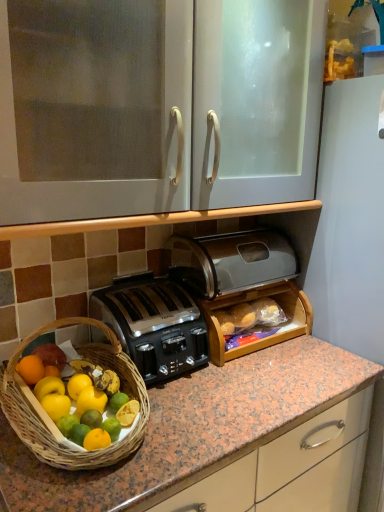
Question: Can you confirm if wooden bread box at center, which is the second cabinetry in top-to-bottom order, is bigger than satin black toaster at center, arranged as the second toaster when ordered from the bottom?

Choices:
 (A) no
 (B) yes

Answer: (A)

Question: Does wooden bread box at center, acting as the first cabinetry starting from the bottom, have a smaller size compared to satin black toaster at center, arranged as the first toaster when viewed from the top?

Choices:
 (A) no
 (B) yes

Answer: (B)

Question: Can you confirm if wooden bread box at center, which is the second cabinetry in top-to-bottom order, is wider than satin black toaster at center, arranged as the first toaster when viewed from the top?

Choices:
 (A) no
 (B) yes

Answer: (A)

Question: Is wooden bread box at center, acting as the first cabinetry starting from the bottom, thinner than satin black toaster at center, arranged as the first toaster when viewed from the top?

Choices:
 (A) no
 (B) yes

Answer: (B)

Question: Does wooden bread box at center, acting as the first cabinetry starting from the bottom, contain satin black toaster at center, arranged as the second toaster when ordered from the bottom?

Choices:
 (A) yes
 (B) no

Answer: (B)

Question: Is wooden bread box at center, which is the second cabinetry in top-to-bottom order, to the right of satin black toaster at center, arranged as the first toaster when viewed from the top, from the viewer's perspective?

Choices:
 (A) yes
 (B) no

Answer: (A)

Question: Is the depth of wooden bread box at center, which is the second cabinetry in top-to-bottom order, greater than that of white glossy cabinet at upper center, which ranks as the 1th cabinetry in top-to-bottom order?

Choices:
 (A) no
 (B) yes

Answer: (B)

Question: Can you confirm if wooden bread box at center, acting as the first cabinetry starting from the bottom, is wider than white glossy cabinet at upper center, the second cabinetry ordered from the bottom?

Choices:
 (A) yes
 (B) no

Answer: (B)

Question: Is wooden bread box at center, acting as the first cabinetry starting from the bottom, far away from white glossy cabinet at upper center, which ranks as the 1th cabinetry in top-to-bottom order?

Choices:
 (A) no
 (B) yes

Answer: (A)

Question: Does wooden bread box at center, acting as the first cabinetry starting from the bottom, have a lesser height compared to white glossy cabinet at upper center, which ranks as the 1th cabinetry in top-to-bottom order?

Choices:
 (A) yes
 (B) no

Answer: (A)

Question: Is wooden bread box at center, which is the second cabinetry in top-to-bottom order, touching white glossy cabinet at upper center, the second cabinetry ordered from the bottom?

Choices:
 (A) no
 (B) yes

Answer: (A)

Question: Is wooden bread box at center, which is the second cabinetry in top-to-bottom order, in front of white glossy cabinet at upper center, the second cabinetry ordered from the bottom?

Choices:
 (A) no
 (B) yes

Answer: (A)

Question: Is the surface of satin black toaster at center, the 1th toaster ordered from the bottom, in direct contact with wooden bread box at center, acting as the first cabinetry starting from the bottom?

Choices:
 (A) yes
 (B) no

Answer: (B)